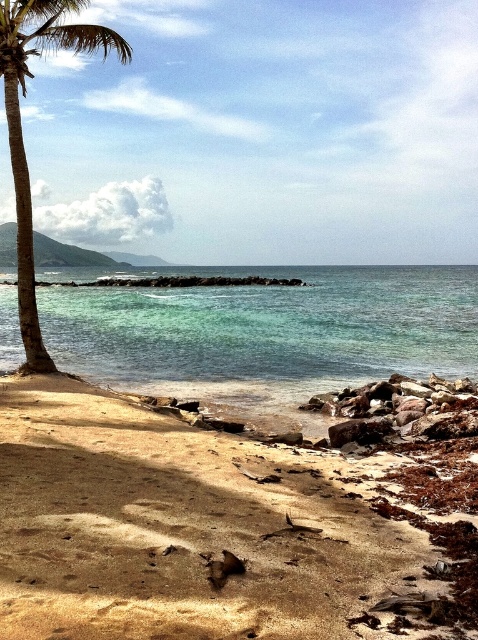
You are standing at the point marked by the coordinates point (229, 522), which is on the brown sandy beach at lower left. If you want to walk towards the palm tree on the left side of the frame, which direction should you face?

The palm tree is on the left side of the frame, so you should face towards the left side of the frame to walk towards it from the brown sandy beach at lower left.